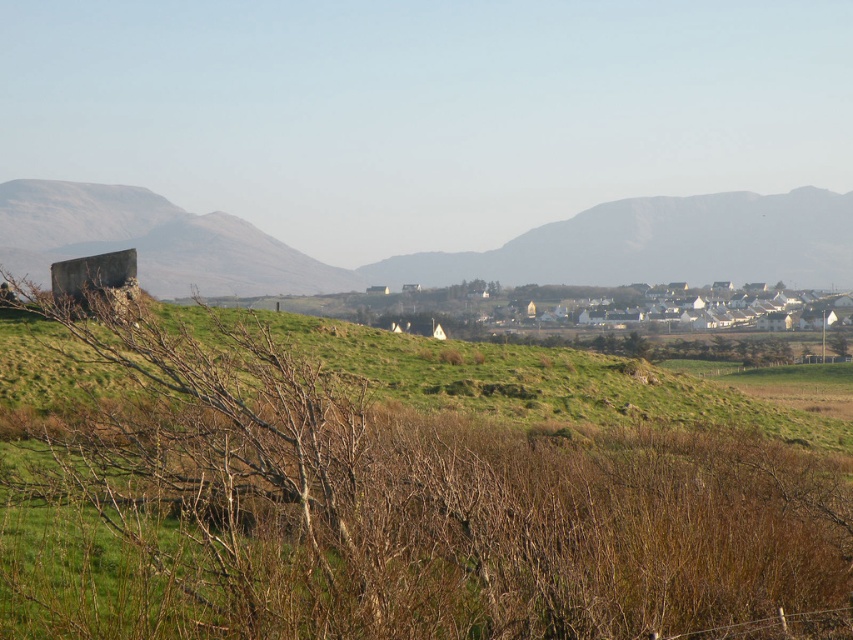
Consider the image. You are a hiker planning to cross the terrain between the brown dry bush at left and the smooth gray rock at left. Considering their sizes, which object might provide better cover from sudden rain showers?

The brown dry bush at left is larger in size than the smooth gray rock at left, so it would provide better cover from sudden rain showers.